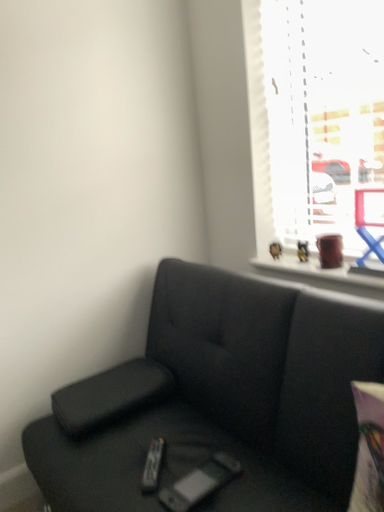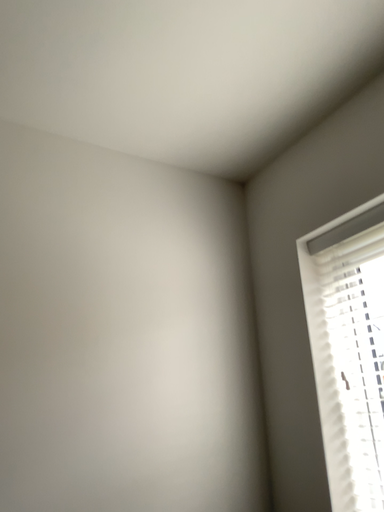
Question: How did the camera likely rotate when shooting the video?

Choices:
 (A) rotated right
 (B) rotated left

Answer: (B)